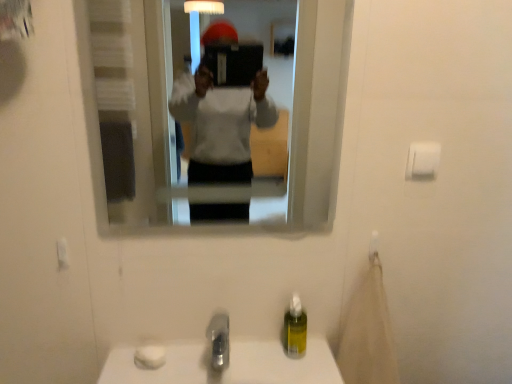
Locate an element on the screen. This screenshot has height=384, width=512. white matte toilet paper at upper right is located at coordinates (423, 160).

What do you see at coordinates (173, 116) in the screenshot? I see `clear glass mirror at upper center` at bounding box center [173, 116].

This screenshot has height=384, width=512. I want to click on white matte toilet paper at upper right, so click(423, 160).

Is white matte toilet paper at upper right bigger or smaller than clear glass mirror at upper center?

Clearly, white matte toilet paper at upper right is smaller in size than clear glass mirror at upper center.

Is white matte toilet paper at upper right to the left or to the right of clear glass mirror at upper center in the image?

white matte toilet paper at upper right is to the right of clear glass mirror at upper center.

Considering the sizes of objects satin nickel faucet at lower center and yellow translucent soap dispenser at lower center in the image provided, who is taller, satin nickel faucet at lower center or yellow translucent soap dispenser at lower center?

yellow translucent soap dispenser at lower center is taller.

Is satin nickel faucet at lower center situated inside yellow translucent soap dispenser at lower center or outside?

satin nickel faucet at lower center is spatially situated outside yellow translucent soap dispenser at lower center.

From the image's perspective, is clear glass mirror at upper center above yellow translucent soap dispenser at lower center?

Yes, from the image's perspective, clear glass mirror at upper center is above yellow translucent soap dispenser at lower center.

From a real-world perspective, is clear glass mirror at upper center on yellow translucent soap dispenser at lower center?

Correct, in the physical world, clear glass mirror at upper center is higher than yellow translucent soap dispenser at lower center.

Considering the sizes of objects clear glass mirror at upper center and yellow translucent soap dispenser at lower center in the image provided, who is taller, clear glass mirror at upper center or yellow translucent soap dispenser at lower center?

clear glass mirror at upper center is taller.

From the image's perspective, is yellow translucent soap dispenser at lower center under satin nickel faucet at lower center?

No, from the image's perspective, yellow translucent soap dispenser at lower center is not beneath satin nickel faucet at lower center.

Can you confirm if yellow translucent soap dispenser at lower center is shorter than satin nickel faucet at lower center?

Incorrect, the height of yellow translucent soap dispenser at lower center does not fall short of that of satin nickel faucet at lower center.

Does yellow translucent soap dispenser at lower center lie behind satin nickel faucet at lower center?

Yes, the depth of yellow translucent soap dispenser at lower center is greater than that of satin nickel faucet at lower center.

Is yellow translucent soap dispenser at lower center looking in the opposite direction of satin nickel faucet at lower center?

That's not correct — yellow translucent soap dispenser at lower center is not looking away from satin nickel faucet at lower center.

Based on their positions, is satin nickel faucet at lower center located to the left or right of clear glass mirror at upper center?

Clearly, satin nickel faucet at lower center is on the left of clear glass mirror at upper center in the image.

Are satin nickel faucet at lower center and clear glass mirror at upper center far apart?

Yes, satin nickel faucet at lower center is far from clear glass mirror at upper center.

I want to click on mirror in front of the satin nickel faucet at lower center, so click(173, 116).

Is satin nickel faucet at lower center bigger than clear glass mirror at upper center?

No, satin nickel faucet at lower center is not bigger than clear glass mirror at upper center.

Which is more to the left, clear glass mirror at upper center or white matte toilet paper at upper right?

From the viewer's perspective, clear glass mirror at upper center appears more on the left side.

Looking at this image, from a real-world perspective, is clear glass mirror at upper center under white matte toilet paper at upper right?

No, from a real-world perspective, clear glass mirror at upper center is not beneath white matte toilet paper at upper right.

Which object is closer to the camera taking this photo, clear glass mirror at upper center or white matte toilet paper at upper right?

clear glass mirror at upper center is closer to the camera.

Is yellow translucent soap dispenser at lower center bigger or smaller than clear glass mirror at upper center?

yellow translucent soap dispenser at lower center is smaller than clear glass mirror at upper center.

Can you confirm if yellow translucent soap dispenser at lower center is wider than clear glass mirror at upper center?

Yes.

Does yellow translucent soap dispenser at lower center contain clear glass mirror at upper center?

Actually, clear glass mirror at upper center is outside yellow translucent soap dispenser at lower center.

Considering the positions of objects yellow translucent soap dispenser at lower center and clear glass mirror at upper center in the image provided, who is behind, yellow translucent soap dispenser at lower center or clear glass mirror at upper center?

yellow translucent soap dispenser at lower center.

At what (x,y) coordinates should I click in order to perform the action: click on toilet paper located underneath the clear glass mirror at upper center (from a real-world perspective). Please return your answer as a coordinate pair (x, y). Looking at the image, I should click on (423, 160).

Where is `tap that is on the left side of yellow translucent soap dispenser at lower center`? tap that is on the left side of yellow translucent soap dispenser at lower center is located at coordinates (219, 340).

Considering their positions, is white matte toilet paper at upper right positioned further to satin nickel faucet at lower center than yellow translucent soap dispenser at lower center?

white matte toilet paper at upper right is further to satin nickel faucet at lower center.

From the image, which object appears to be nearer to satin nickel faucet at lower center, clear glass mirror at upper center or white matte toilet paper at upper right?

Among the two, white matte toilet paper at upper right is located nearer to satin nickel faucet at lower center.

In the scene shown: When comparing their distances from satin nickel faucet at lower center, does clear glass mirror at upper center or yellow translucent soap dispenser at lower center seem closer?

Based on the image, yellow translucent soap dispenser at lower center appears to be nearer to satin nickel faucet at lower center.

In the scene shown: Considering their positions, is clear glass mirror at upper center positioned closer to white matte toilet paper at upper right than satin nickel faucet at lower center?

satin nickel faucet at lower center.

Based on their spatial positions, is satin nickel faucet at lower center or yellow translucent soap dispenser at lower center further from clear glass mirror at upper center?

yellow translucent soap dispenser at lower center.

Estimate the real-world distances between objects in this image. Which object is closer to white matte toilet paper at upper right, satin nickel faucet at lower center or clear glass mirror at upper center?

satin nickel faucet at lower center is closer to white matte toilet paper at upper right.

When comparing their distances from satin nickel faucet at lower center, does yellow translucent soap dispenser at lower center or white matte toilet paper at upper right seem further?

white matte toilet paper at upper right is positioned further to the anchor satin nickel faucet at lower center.

Considering their positions, is white matte toilet paper at upper right positioned further to clear glass mirror at upper center than satin nickel faucet at lower center?

Based on the image, white matte toilet paper at upper right appears to be further to clear glass mirror at upper center.

Identify the location of toilet paper that lies between clear glass mirror at upper center and satin nickel faucet at lower center from top to bottom. This screenshot has width=512, height=384. (423, 160).

At what (x,y) coordinates should I click in order to perform the action: click on soap dispenser between clear glass mirror at upper center and satin nickel faucet at lower center from top to bottom. Please return your answer as a coordinate pair (x, y). This screenshot has height=384, width=512. Looking at the image, I should click on (295, 329).

Locate an element on the screen. The height and width of the screenshot is (384, 512). soap dispenser between white matte toilet paper at upper right and satin nickel faucet at lower center from top to bottom is located at coordinates (295, 329).

Image resolution: width=512 pixels, height=384 pixels. What are the coordinates of `toilet paper between clear glass mirror at upper center and yellow translucent soap dispenser at lower center in the up-down direction` in the screenshot? It's located at (423, 160).